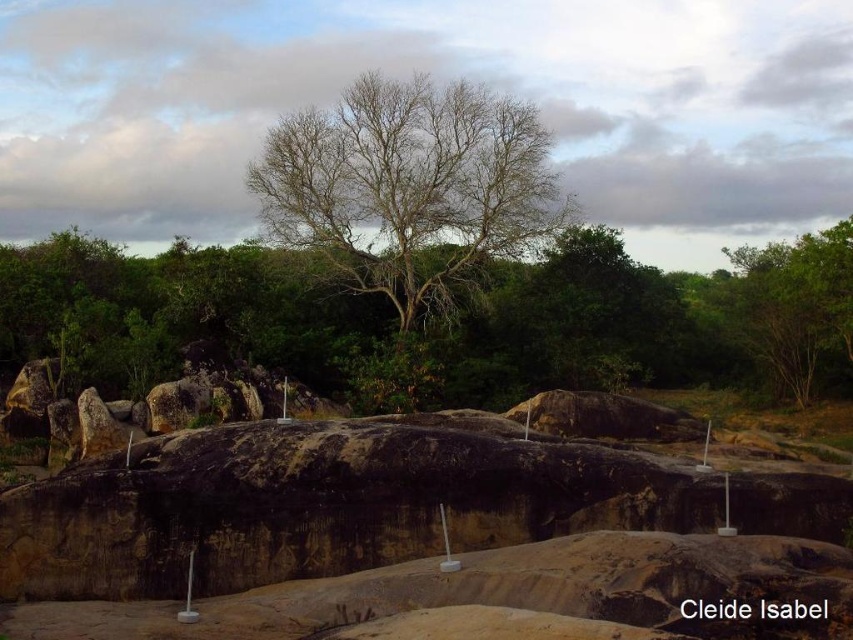
Question: Which of the following is the closest to the observer?

Choices:
 (A) green leafy tree at upper right
 (B) bare branches at center

Answer: (A)

Question: Which object appears closest to the camera in this image?

Choices:
 (A) green leafy tree at upper right
 (B) bare branches at center

Answer: (A)

Question: Does bare branches at center appear under green leafy tree at upper right?

Choices:
 (A) yes
 (B) no

Answer: (B)

Question: Can you confirm if bare branches at center is thinner than green leafy tree at upper right?

Choices:
 (A) no
 (B) yes

Answer: (B)

Question: Is bare branches at center positioned at the back of green leafy tree at upper right?

Choices:
 (A) yes
 (B) no

Answer: (A)